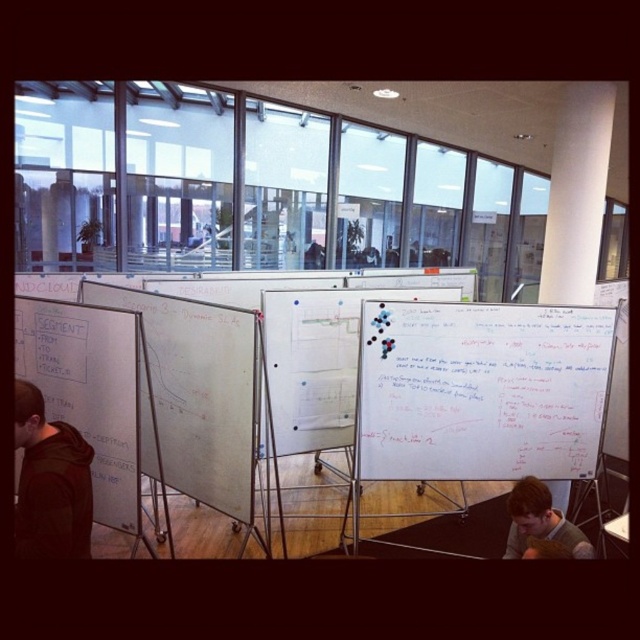
You are an architect planning to install a new light fixture in the conference room. You need to determine the best location to avoid casting shadows on both the white matte whiteboard at left and the white smooth pillar at upper center. Based on the scene description, which object is positioned lower, and how might this affect your lighting plan?

The white matte whiteboard at left is located below the white smooth pillar at upper center. Since the whiteboard is lower, placing the light fixture above both objects would ensure that the pillar does not cast a shadow on the whiteboard, while also avoiding shadows on the pillar itself.

You are a visitor standing in the conference room. You notice a white smooth pillar at upper center and a gray sweater at lower right. Which object is taller?

The white smooth pillar at upper center is taller than the gray sweater at lower right.